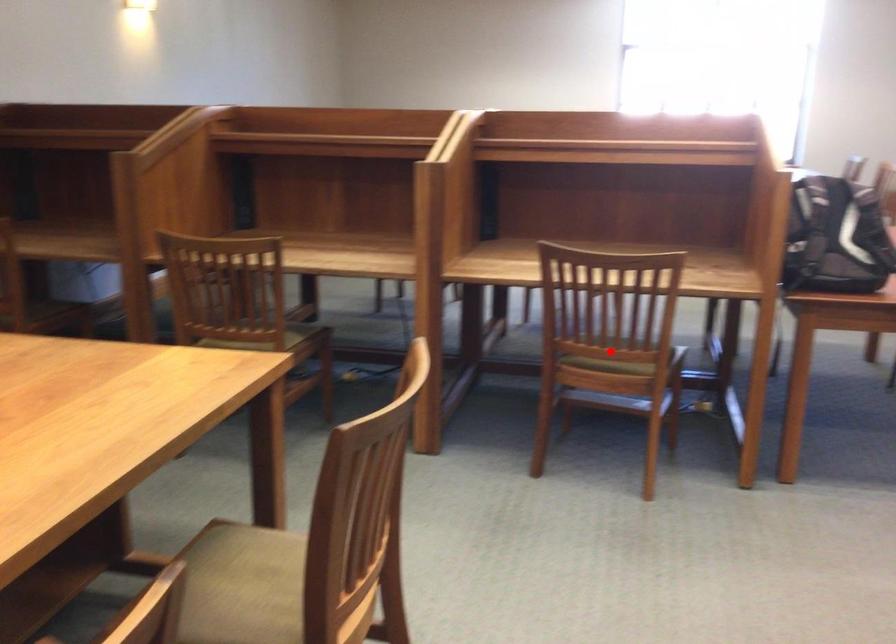
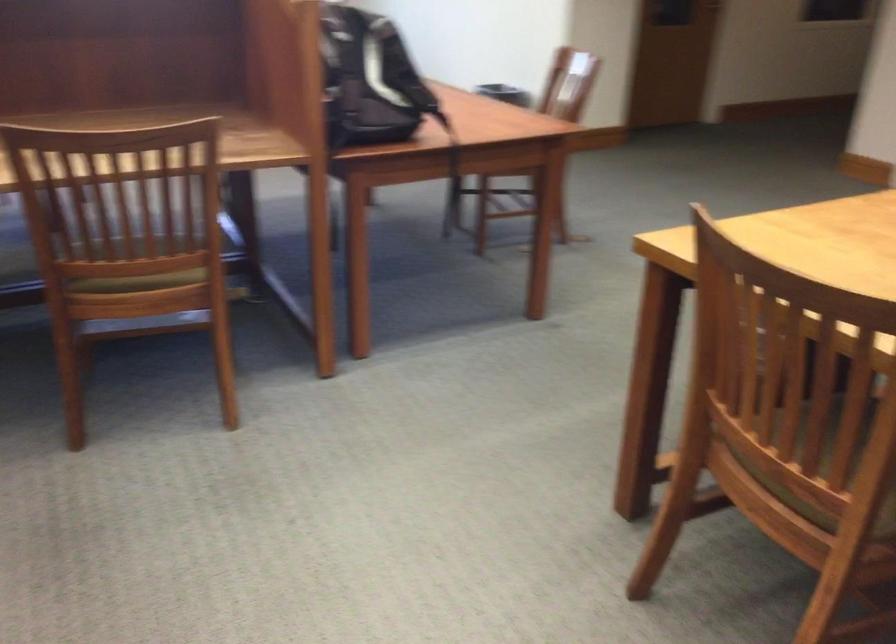
Question: A red point is marked in image1. In image2, is the corresponding 3D point closer to the camera or farther? Reply with the corresponding letter.

Choices:
 (A) The corresponding 3D point is closer.
 (B) The corresponding 3D point is farther.

Answer: (A)